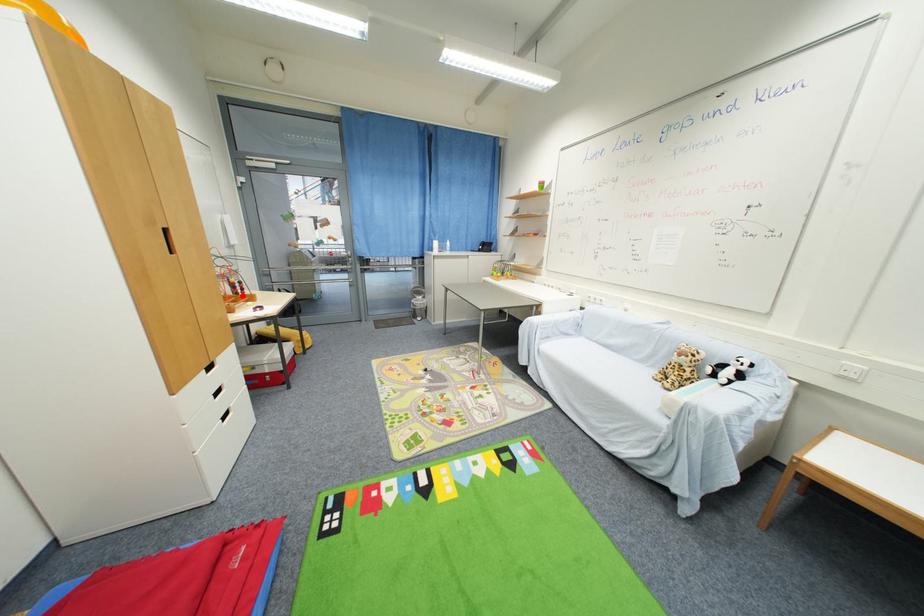
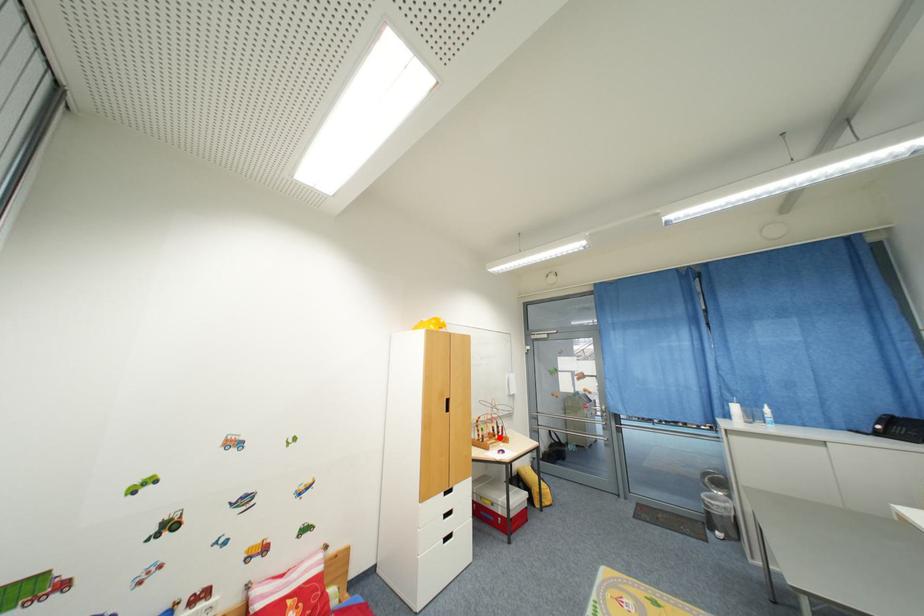
I am providing you with two images of the same scene from different viewpoints. A red point is marked on the first image and another point is marked on the second image. Does the point marked in image1 correspond to the same location as the one in image2?

Yes